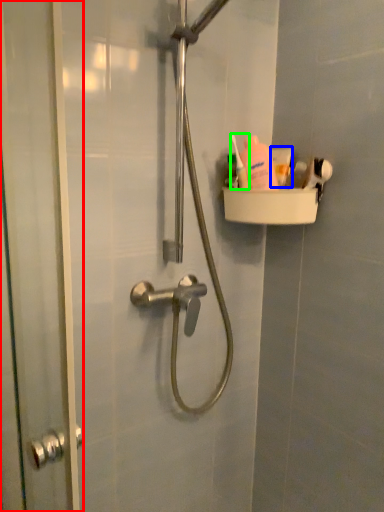
Question: Based on their relative distances, which object is farther from screen door (highlighted by a red box)? Choose from toothpaste (highlighted by a blue box) and toiletry (highlighted by a green box).

Choices:
 (A) toothpaste
 (B) toiletry

Answer: (A)